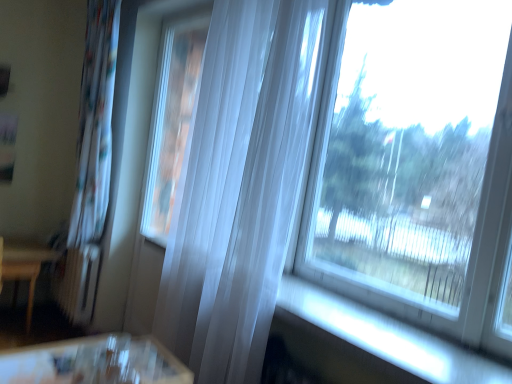
Question: Does wooden table at left have a lesser width compared to transparent glass window at upper right?

Choices:
 (A) yes
 (B) no

Answer: (B)

Question: Is wooden table at left closer to camera compared to transparent glass window at upper right?

Choices:
 (A) no
 (B) yes

Answer: (A)

Question: Considering the relative positions of wooden table at left and transparent glass window at upper right in the image provided, is wooden table at left to the right of transparent glass window at upper right from the viewer's perspective?

Choices:
 (A) no
 (B) yes

Answer: (A)

Question: Is wooden table at left shorter than transparent glass window at upper right?

Choices:
 (A) no
 (B) yes

Answer: (B)

Question: Is wooden table at left outside of transparent glass window at upper right?

Choices:
 (A) no
 (B) yes

Answer: (B)

Question: From the image's perspective, is wooden table at left below transparent glass window at upper right?

Choices:
 (A) no
 (B) yes

Answer: (B)

Question: Is white sheer curtain at left, which is the 2th curtain in front-to-back order, not within translucent white curtain at center, the first curtain viewed from the right?

Choices:
 (A) no
 (B) yes

Answer: (B)

Question: Does white sheer curtain at left, the first curtain in the back-to-front sequence, appear on the left side of translucent white curtain at center, acting as the 2th curtain starting from the left?

Choices:
 (A) yes
 (B) no

Answer: (A)

Question: Is translucent white curtain at center, the first curtain viewed from the right, completely or partially inside white sheer curtain at left, the first curtain in the back-to-front sequence?

Choices:
 (A) no
 (B) yes

Answer: (A)

Question: From a real-world perspective, does white sheer curtain at left, placed as the first curtain when sorted from left to right, stand above translucent white curtain at center, the first curtain viewed from the right?

Choices:
 (A) yes
 (B) no

Answer: (B)

Question: From a real-world perspective, is white sheer curtain at left, the 2th curtain positioned from the right, physically below translucent white curtain at center, acting as the 2th curtain starting from the left?

Choices:
 (A) no
 (B) yes

Answer: (B)

Question: Considering the relative sizes of white sheer curtain at left, the 2th curtain positioned from the right, and translucent white curtain at center, which appears as the second curtain when viewed from the back, in the image provided, is white sheer curtain at left, the 2th curtain positioned from the right, wider than translucent white curtain at center, which appears as the second curtain when viewed from the back,?

Choices:
 (A) yes
 (B) no

Answer: (A)

Question: From the image's perspective, is transparent glass window at upper right on white sheer curtain at left, placed as the first curtain when sorted from left to right?

Choices:
 (A) no
 (B) yes

Answer: (B)